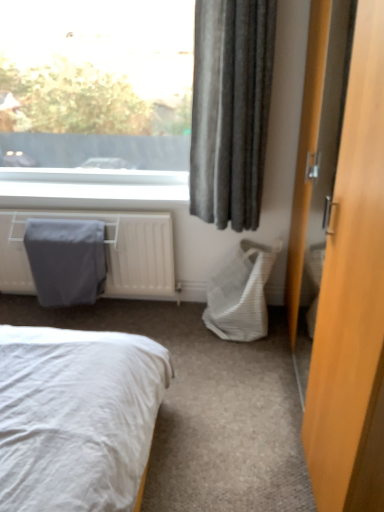
Question: Would you say white woven laundry basket at lower right is to the left or to the right of gray fabric blanket at left in the picture?

Choices:
 (A) right
 (B) left

Answer: (A)

Question: From a real-world perspective, is white woven laundry basket at lower right positioned above or below gray fabric blanket at left?

Choices:
 (A) above
 (B) below

Answer: (B)

Question: Which of these objects is positioned farthest from the gray fabric blanket at left?

Choices:
 (A) white woven laundry basket at lower right
 (B) dark grey fabric curtain at upper right
 (C) gray fabric-covered radiator at left
 (D) wooden door at right

Answer: (D)

Question: Which object is positioned closest to the gray fabric blanket at left?

Choices:
 (A) dark grey fabric curtain at upper right
 (B) white woven laundry basket at lower right
 (C) gray fabric-covered radiator at left
 (D) wooden door at right

Answer: (C)